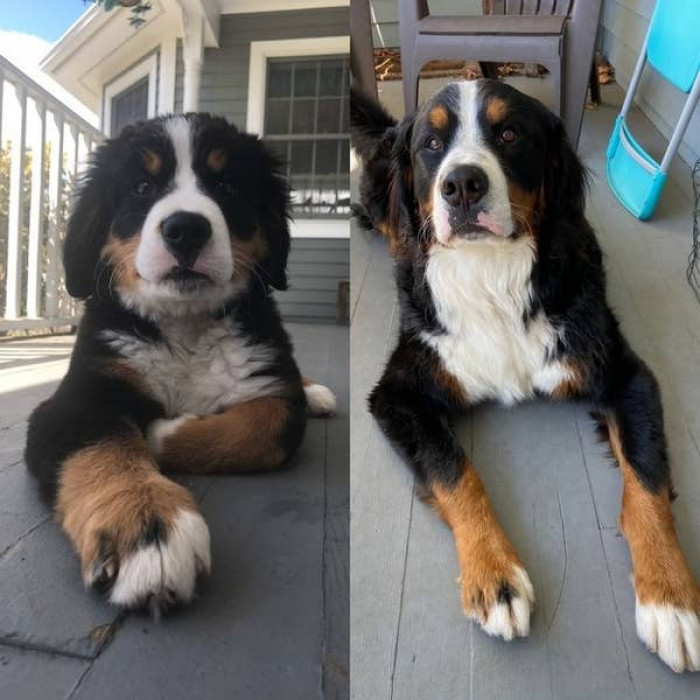
The width and height of the screenshot is (700, 700). What are the coordinates of `blue folded chair` in the screenshot? It's located at (622, 176).